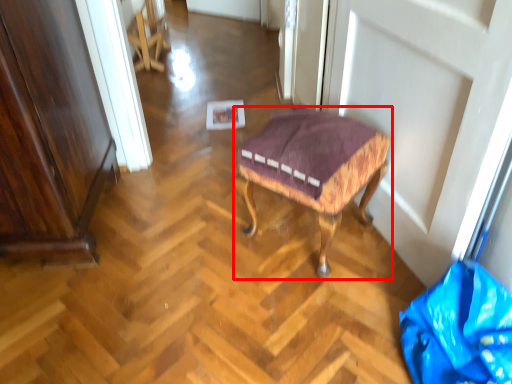
Question: Where is stool (annotated by the red box) located in relation to material in the image?

Choices:
 (A) right
 (B) left

Answer: (B)